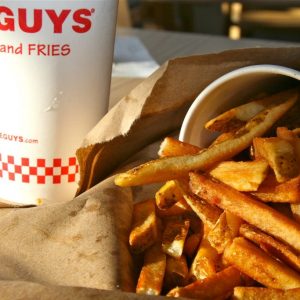
Locate an element on the screen. The image size is (300, 300). surface is located at coordinates (179, 41).